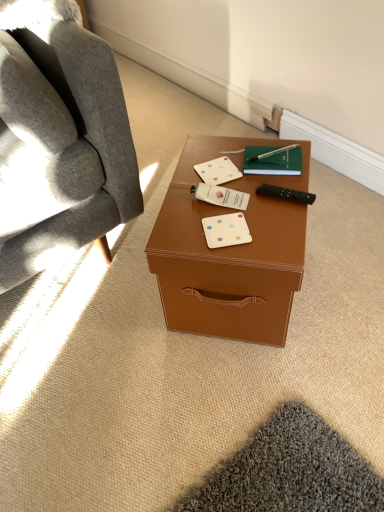
You are a GUI agent. You are given a task and a screenshot of the screen. Output one action in this format:
    pyautogui.click(x=<x>, y=<y>)
    Task: Click on the vacant space in front of white matte business card at center, marked as the third business card in a bottom-to-top arrangement
    The height and width of the screenshot is (512, 384).
    Given the screenshot: What is the action you would take?
    pyautogui.click(x=225, y=218)